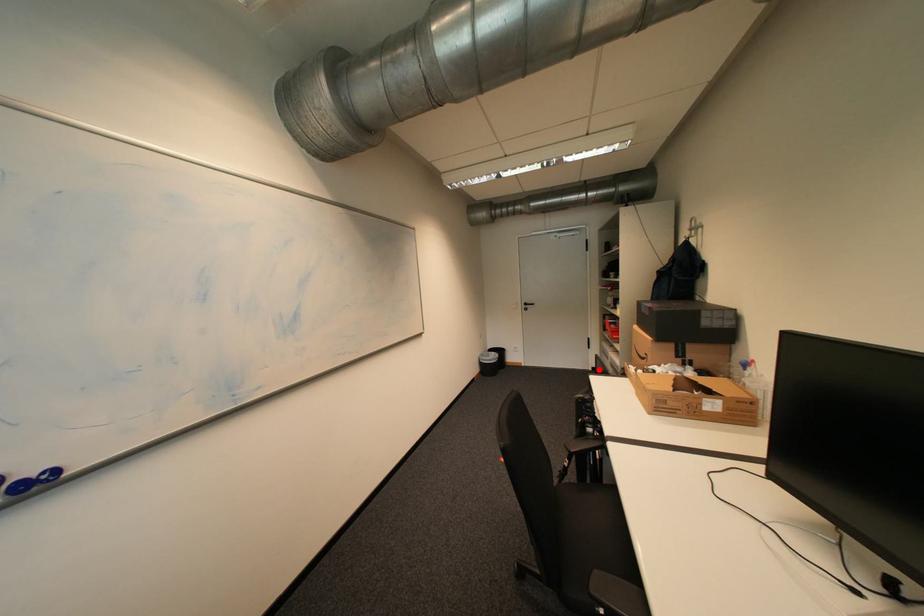
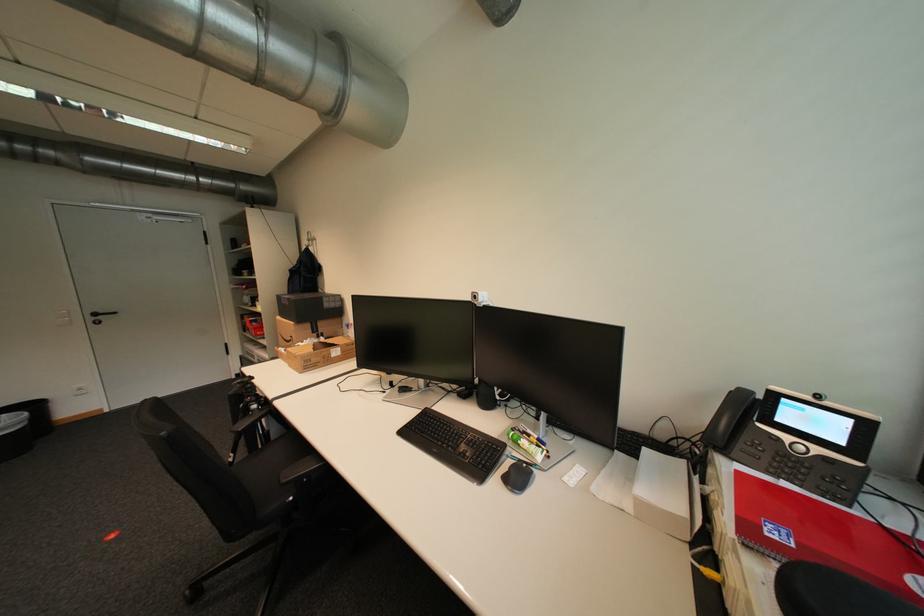
Question: A red point is marked in image1. In image2, is the corresponding 3D point closer to the camera or farther? Reply with the corresponding letter.

Choices:
 (A) The corresponding 3D point is closer.
 (B) The corresponding 3D point is farther.

Answer: (B)